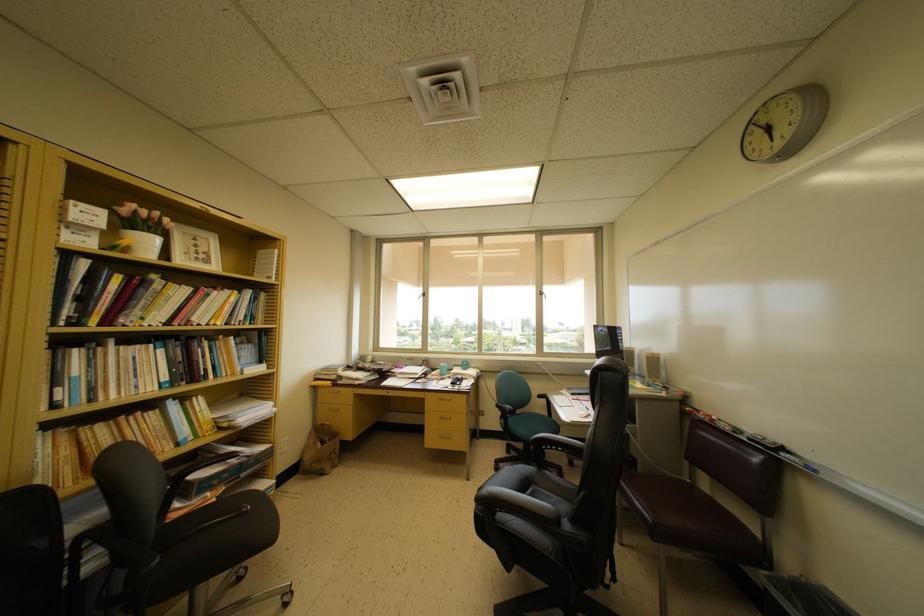
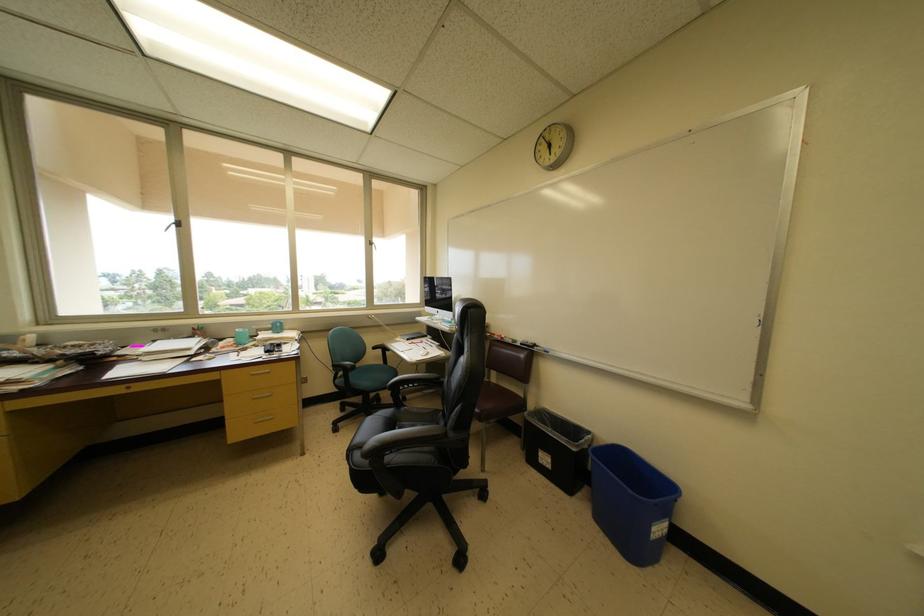
Find the pixel in the second image that matches point 535,496 in the first image.

(400, 432)